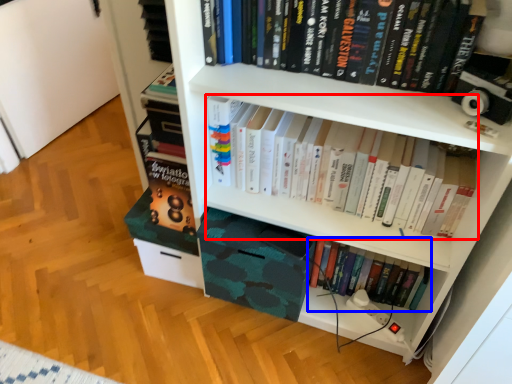
Question: Among these objects, which one is farthest to the camera, book (highlighted by a red box) or book (highlighted by a blue box)?

Choices:
 (A) book
 (B) book

Answer: (B)